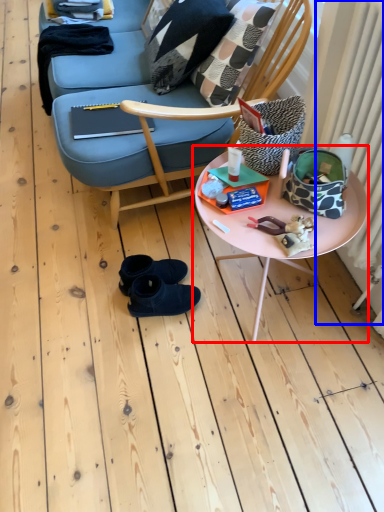
Question: Which object is further to the camera taking this photo, table (highlighted by a red box) or radiator (highlighted by a blue box)?

Choices:
 (A) table
 (B) radiator

Answer: (A)